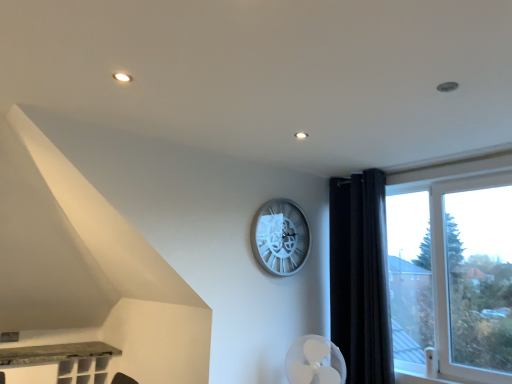
This screenshot has width=512, height=384. Describe the element at coordinates (442, 228) in the screenshot. I see `transparent glass window at right` at that location.

The height and width of the screenshot is (384, 512). Find the location of `silver metallic clock at center`. silver metallic clock at center is located at coordinates (280, 237).

Looking at their sizes, would you say black velvet curtain at right is wider or thinner than silver metallic clock at center?

black velvet curtain at right is wider than silver metallic clock at center.

Which of these two, black velvet curtain at right or silver metallic clock at center, is smaller?

silver metallic clock at center is smaller.

From a real-world perspective, which object rests below the other?

From a 3D spatial view, black velvet curtain at right is below.

Is black velvet curtain at right turned away from silver metallic clock at center?

No, black velvet curtain at right is not facing the opposite direction of silver metallic clock at center.

Which object is positioned more to the right, transparent glass window at right or black velvet curtain at right?

Positioned to the right is transparent glass window at right.

Does transparent glass window at right lie in front of black velvet curtain at right?

Yes, it is in front of black velvet curtain at right.

Which of these two, transparent glass window at right or black velvet curtain at right, is thinner?

With smaller width is transparent glass window at right.

From the image's perspective, is transparent glass window at right beneath black velvet curtain at right?

Actually, transparent glass window at right appears above black velvet curtain at right in the image.

Considering the sizes of objects silver metallic clock at center and black velvet curtain at right in the image provided, who is wider, silver metallic clock at center or black velvet curtain at right?

black velvet curtain at right is wider.

Can you confirm if silver metallic clock at center is positioned to the left of black velvet curtain at right?

Indeed, silver metallic clock at center is positioned on the left side of black velvet curtain at right.

Which is closer, (x=289, y=245) or (x=357, y=294)?

Clearly, point (x=289, y=245) is more distant from the camera than point (x=357, y=294).

Is silver metallic clock at center positioned before black velvet curtain at right?

No, it is not.

Between transparent glass window at right and silver metallic clock at center, which one has smaller size?

silver metallic clock at center is smaller.

Consider the image. Can we say transparent glass window at right lies outside silver metallic clock at center?

transparent glass window at right lies outside silver metallic clock at center's area.

Considering the points (438, 197) and (273, 229), which point is behind, point (438, 197) or point (273, 229)?

The point (273, 229) is behind.

Who is shorter, silver metallic clock at center or transparent glass window at right?

With less height is silver metallic clock at center.

Which is closer to the camera, (275, 204) or (465, 372)?

Clearly, point (275, 204) is more distant from the camera than point (465, 372).

Does silver metallic clock at center contain transparent glass window at right?

No, transparent glass window at right is not inside silver metallic clock at center.

How distant is silver metallic clock at center from transparent glass window at right?

silver metallic clock at center is 36.51 inches from transparent glass window at right.

From the image's perspective, between black velvet curtain at right and transparent glass window at right, who is located below?

black velvet curtain at right is shown below in the image.

Looking at this image, from their relative heights in the image, would you say black velvet curtain at right is taller or shorter than transparent glass window at right?

Clearly, black velvet curtain at right is taller compared to transparent glass window at right.

The height and width of the screenshot is (384, 512). I want to click on curtain below the transparent glass window at right (from the image's perspective), so click(x=360, y=277).

Does black velvet curtain at right have a lesser width compared to transparent glass window at right?

No, black velvet curtain at right is not thinner than transparent glass window at right.

Find the location of a particular element. The height and width of the screenshot is (384, 512). wall clock above the black velvet curtain at right (from the image's perspective) is located at coordinates (280, 237).

What are the coordinates of `window on the right of black velvet curtain at right` in the screenshot? It's located at (442, 228).

Based on their spatial positions, is black velvet curtain at right or transparent glass window at right closer to silver metallic clock at center?

black velvet curtain at right.

Which object lies nearer to the anchor point black velvet curtain at right, transparent glass window at right or silver metallic clock at center?

transparent glass window at right.

Based on their spatial positions, is silver metallic clock at center or black velvet curtain at right closer to transparent glass window at right?

black velvet curtain at right lies closer to transparent glass window at right than the other object.

Based on their spatial positions, is transparent glass window at right or black velvet curtain at right further from silver metallic clock at center?

The object further to silver metallic clock at center is transparent glass window at right.

Consider the image. Based on their spatial positions, is black velvet curtain at right or silver metallic clock at center closer to transparent glass window at right?

Based on the image, black velvet curtain at right appears to be nearer to transparent glass window at right.

Considering their positions, is silver metallic clock at center positioned further to black velvet curtain at right than transparent glass window at right?

silver metallic clock at center is further to black velvet curtain at right.

Find the location of a particular element. Image resolution: width=512 pixels, height=384 pixels. curtain between silver metallic clock at center and transparent glass window at right in the horizontal direction is located at coordinates (360, 277).